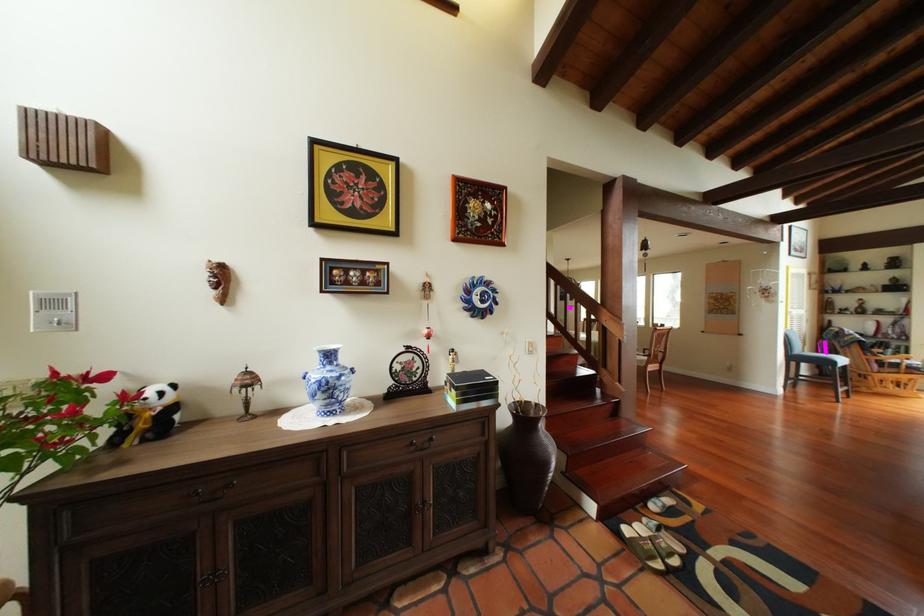
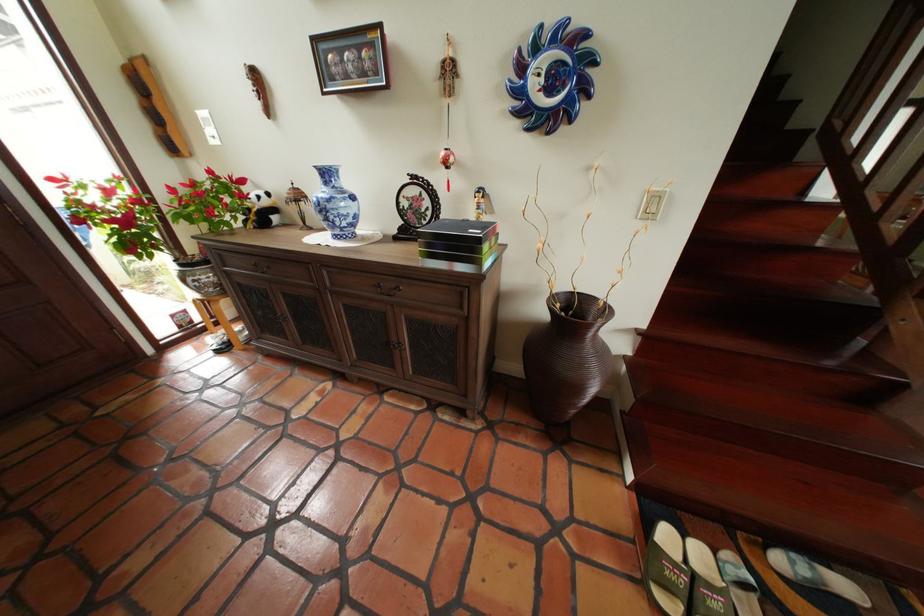
The point at (667, 505) is marked in the first image. Where is the corresponding point in the second image?

(806, 564)